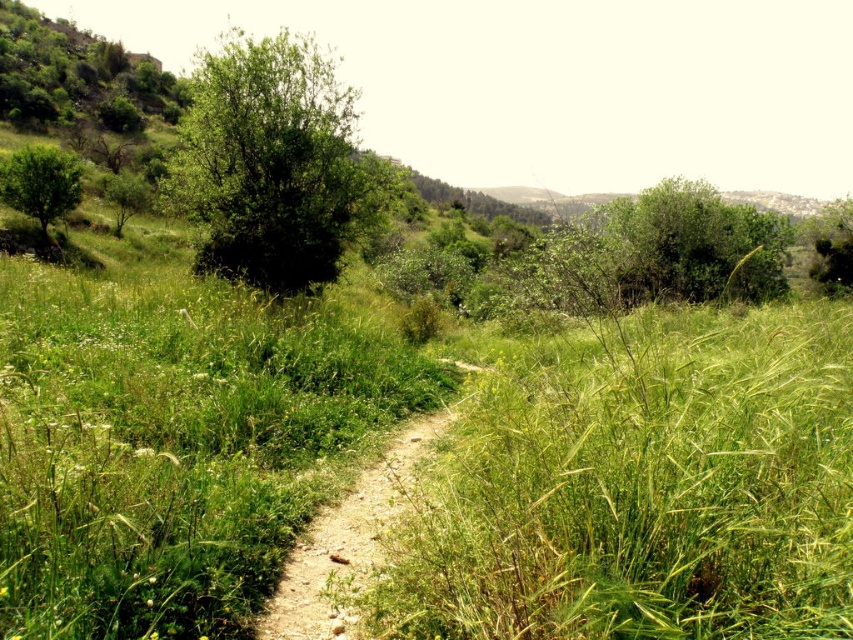
Question: In this image, where is green leafy bush at upper right located relative to dirt path at center?

Choices:
 (A) right
 (B) left

Answer: (A)

Question: Is green leafy bush at center above green leafy bush at upper right?

Choices:
 (A) no
 (B) yes

Answer: (B)

Question: Which object is farther from the camera taking this photo?

Choices:
 (A) dirt path at center
 (B) green leafy bush at upper right

Answer: (B)

Question: Which object is positioned farthest from the dirt path at center?

Choices:
 (A) green leafy bush at upper right
 (B) green leafy tree at left
 (C) green leafy tree at upper right

Answer: (B)

Question: Which object is farther from the camera taking this photo?

Choices:
 (A) dirt path at center
 (B) green leafy tree at upper right
 (C) green leafy bush at center

Answer: (B)

Question: Does green leafy bush at upper right appear under green leafy tree at left?

Choices:
 (A) no
 (B) yes

Answer: (B)